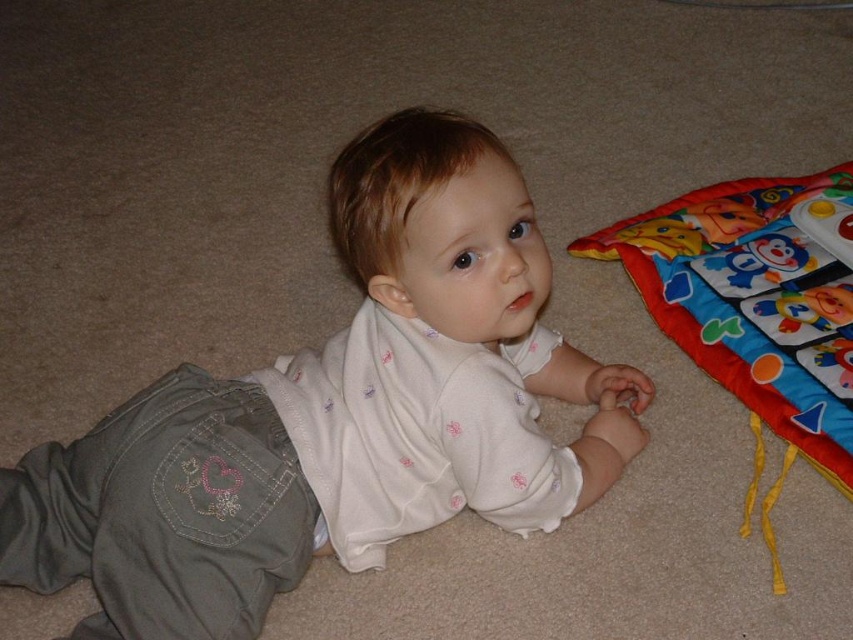
Question: Is white soft baby at center in front of colorful fabric play mat at lower right?

Choices:
 (A) no
 (B) yes

Answer: (B)

Question: Among these objects, which one is farthest from the camera?

Choices:
 (A) white soft baby at center
 (B) colorful fabric play mat at lower right

Answer: (B)

Question: Which object is farther from the camera taking this photo?

Choices:
 (A) colorful fabric play mat at lower right
 (B) white soft baby at center

Answer: (A)

Question: Is the position of white soft baby at center less distant than that of colorful fabric play mat at lower right?

Choices:
 (A) yes
 (B) no

Answer: (A)

Question: Can you confirm if white soft baby at center is thinner than colorful fabric play mat at lower right?

Choices:
 (A) no
 (B) yes

Answer: (A)